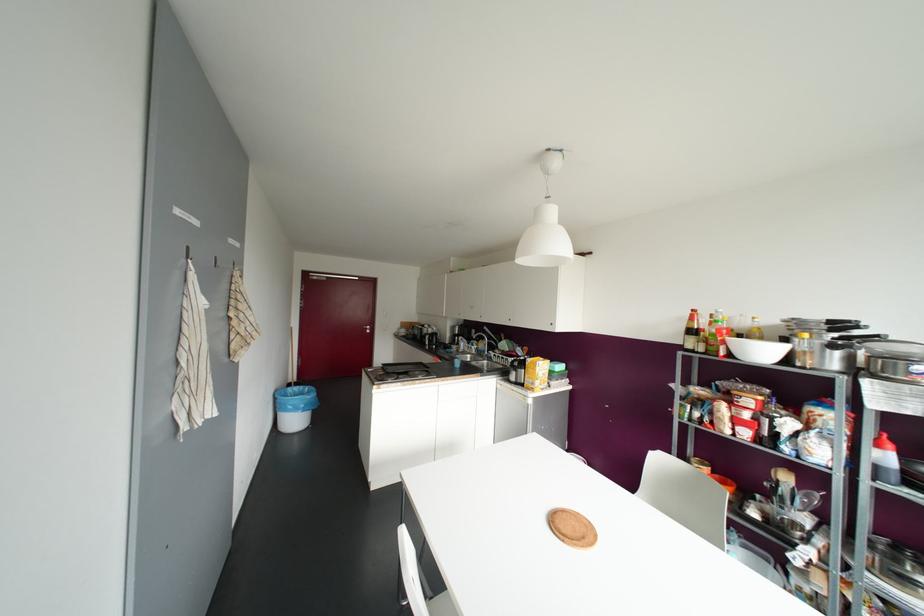
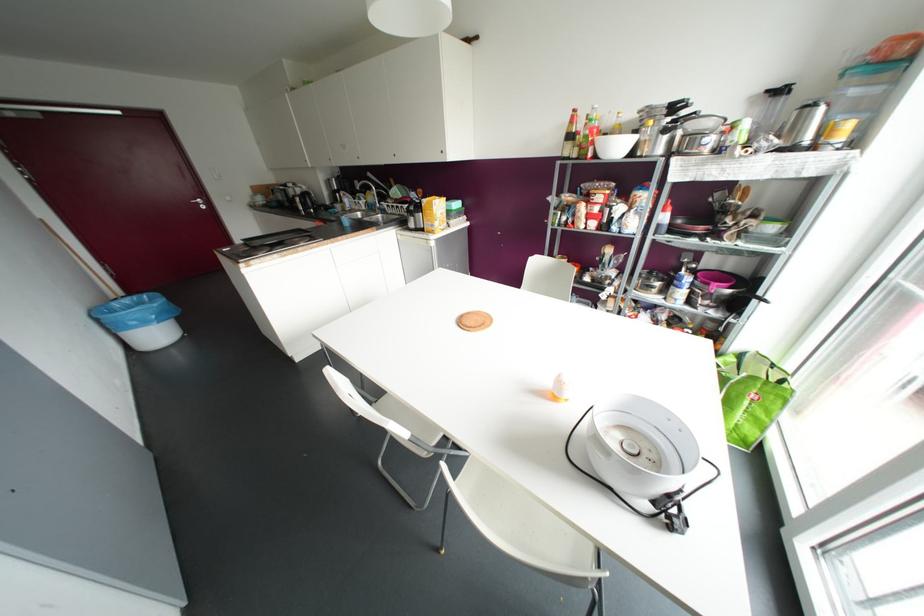
Where in the second image is the point corresponding to point 368,331 from the first image?

(202, 207)